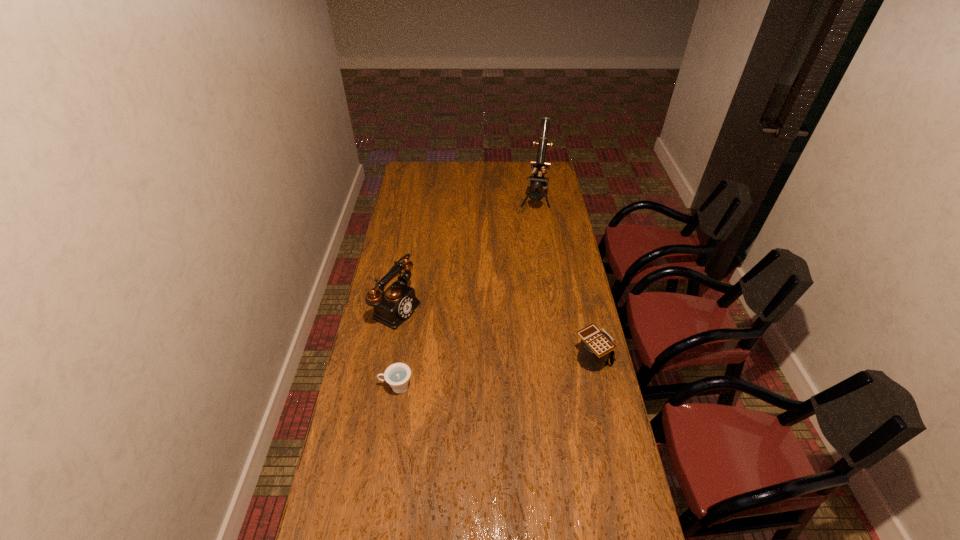
Locate an element on the screen. Image resolution: width=960 pixels, height=540 pixels. free space at the near edge of the desktop is located at coordinates point(540,512).

At what (x,y) coordinates should I click in order to perform the action: click on blank space at the left edge. Please return your answer as a coordinate pair (x, y). Looking at the image, I should click on (360, 435).

The image size is (960, 540). In order to click on vacant space at the right edge of the desktop in this screenshot , I will do `click(581, 405)`.

Image resolution: width=960 pixels, height=540 pixels. What are the coordinates of `vacant area at the far left corner` in the screenshot? It's located at (413, 169).

Locate an element on the screen. free space at the near right corner of the desktop is located at coordinates pyautogui.click(x=606, y=522).

At what (x,y) coordinates should I click in order to perform the action: click on vacant space in between the calculator and the microscope. Please return your answer as a coordinate pair (x, y). The height and width of the screenshot is (540, 960). Looking at the image, I should click on (564, 280).

Identify the location of free space between the shortest object and the telephone. The width and height of the screenshot is (960, 540). (396, 347).

This screenshot has height=540, width=960. What are the coordinates of `empty location between the farthest object and the teacup` in the screenshot? It's located at (466, 294).

The height and width of the screenshot is (540, 960). I want to click on unoccupied area between the shortest object and the microscope, so click(x=466, y=294).

The height and width of the screenshot is (540, 960). Identify the location of empty location between the telephone and the shortest object. (396, 347).